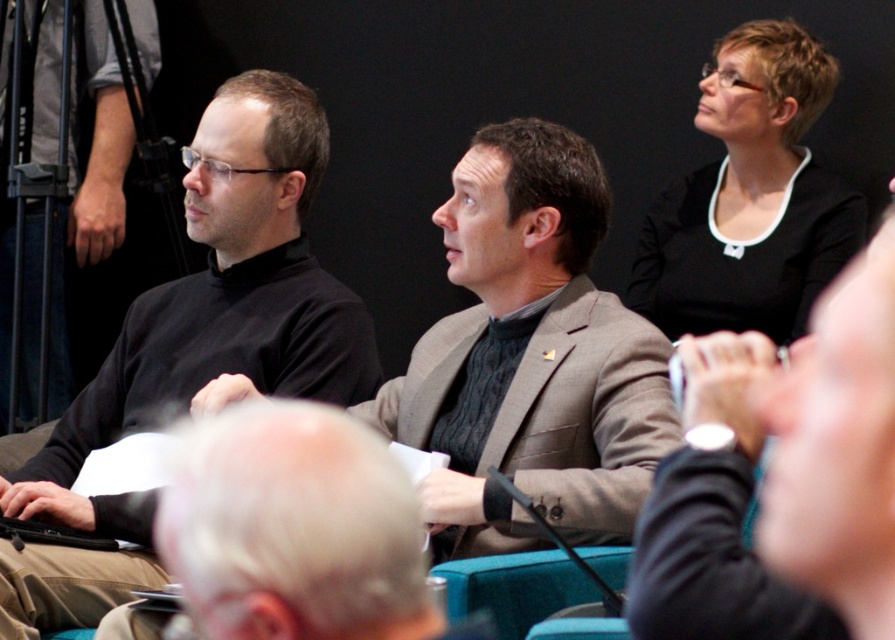
Question: Where is black turtleneck sweater at center located in relation to black matte shirt at upper right in the image?

Choices:
 (A) left
 (B) right

Answer: (A)

Question: Which object appears closest to the camera in this image?

Choices:
 (A) black matte turtleneck sweater at left
 (B) black turtleneck sweater at left

Answer: (A)

Question: Estimate the real-world distances between objects in this image. Which object is closer to the black matte shirt at upper right?

Choices:
 (A) black turtleneck sweater at left
 (B) black turtleneck sweater at center
 (C) black jersey at upper right

Answer: (B)

Question: Estimate the real-world distances between objects in this image. Which object is closer to the black turtleneck sweater at center?

Choices:
 (A) black matte turtleneck sweater at left
 (B) black matte shirt at upper right
 (C) black jersey at upper right
 (D) black turtleneck sweater at left

Answer: (A)

Question: Is black turtleneck sweater at center above black jersey at upper right?

Choices:
 (A) no
 (B) yes

Answer: (B)

Question: Is black matte shirt at upper right smaller than black turtleneck sweater at left?

Choices:
 (A) no
 (B) yes

Answer: (B)